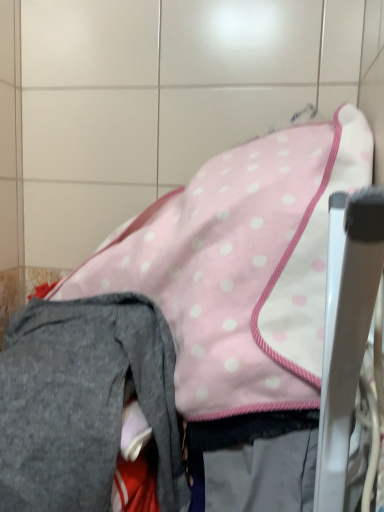
Question: Should I look upward or downward to see gray fleece pants at lower left?

Choices:
 (A) down
 (B) up

Answer: (A)

Question: Is metallic silver chair at right thinner than gray fleece pants at lower left?

Choices:
 (A) yes
 (B) no

Answer: (A)

Question: Is metallic silver chair at right at the right side of gray fleece pants at lower left?

Choices:
 (A) no
 (B) yes

Answer: (B)

Question: Is metallic silver chair at right completely or partially outside of gray fleece pants at lower left?

Choices:
 (A) no
 (B) yes

Answer: (B)

Question: Does metallic silver chair at right have a larger size compared to gray fleece pants at lower left?

Choices:
 (A) no
 (B) yes

Answer: (A)

Question: Can you confirm if metallic silver chair at right is wider than gray fleece pants at lower left?

Choices:
 (A) no
 (B) yes

Answer: (A)

Question: Is the surface of metallic silver chair at right in direct contact with gray fleece pants at lower left?

Choices:
 (A) no
 (B) yes

Answer: (A)

Question: Is pink polka dot fabric at center to the left of metallic silver chair at right from the viewer's perspective?

Choices:
 (A) yes
 (B) no

Answer: (A)

Question: Does pink polka dot fabric at center have a greater width compared to metallic silver chair at right?

Choices:
 (A) yes
 (B) no

Answer: (A)

Question: Is pink polka dot fabric at center bigger than metallic silver chair at right?

Choices:
 (A) no
 (B) yes

Answer: (B)

Question: Is pink polka dot fabric at center to the right of metallic silver chair at right from the viewer's perspective?

Choices:
 (A) yes
 (B) no

Answer: (B)

Question: Considering the relative sizes of pink polka dot fabric at center and metallic silver chair at right in the image provided, is pink polka dot fabric at center smaller than metallic silver chair at right?

Choices:
 (A) no
 (B) yes

Answer: (A)

Question: Considering the relative sizes of pink polka dot fabric at center and metallic silver chair at right in the image provided, is pink polka dot fabric at center taller than metallic silver chair at right?

Choices:
 (A) no
 (B) yes

Answer: (B)

Question: Is gray fleece pants at lower left turned away from metallic silver chair at right?

Choices:
 (A) no
 (B) yes

Answer: (A)